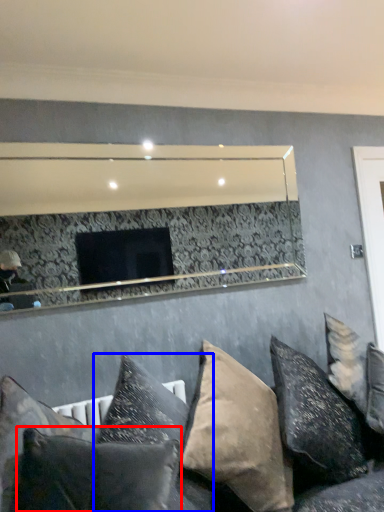
Question: Among these objects, which one is nearest to the camera, pillow (highlighted by a red box) or pillow (highlighted by a blue box)?

Choices:
 (A) pillow
 (B) pillow

Answer: (A)